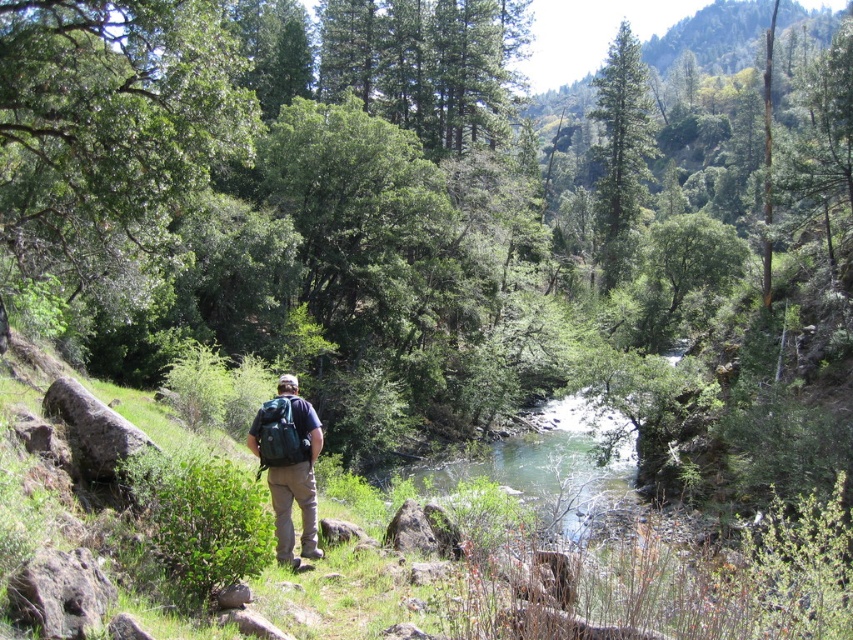
Question: Can you confirm if green textured pine tree at upper center is positioned to the left of teal fabric backpack at center?

Choices:
 (A) no
 (B) yes

Answer: (A)

Question: Among these points, which one is farthest from the camera?

Choices:
 (A) (289, 499)
 (B) (621, 196)

Answer: (B)

Question: Is green textured pine tree at upper center to the right of teal fabric backpack at center from the viewer's perspective?

Choices:
 (A) no
 (B) yes

Answer: (B)

Question: In this image, where is green textured pine tree at upper center located relative to teal fabric backpack at center?

Choices:
 (A) right
 (B) left

Answer: (A)

Question: Which of the following is the closest to the observer?

Choices:
 (A) teal fabric backpack at center
 (B) green textured pine tree at upper center

Answer: (A)